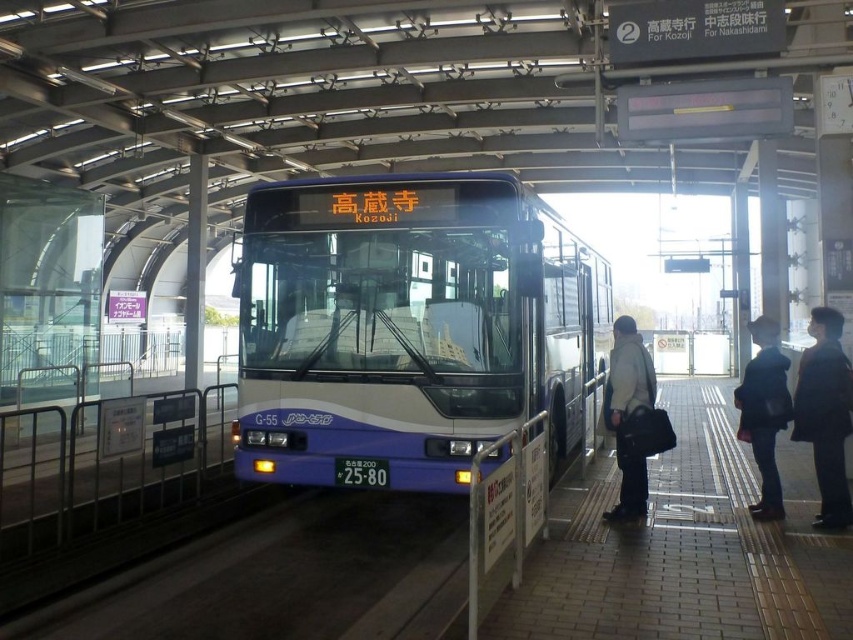
Based on the photo, does blue/white plastic bus at center have a greater height compared to dark blue jacket at right?

Correct, blue/white plastic bus at center is much taller as dark blue jacket at right.

How much distance is there between blue/white plastic bus at center and dark blue jacket at right?

3.01 meters

Describe the element at coordinates (408, 326) in the screenshot. I see `blue/white plastic bus at center` at that location.

Image resolution: width=853 pixels, height=640 pixels. What are the coordinates of `blue/white plastic bus at center` in the screenshot? It's located at (408, 326).

Between point (822, 328) and point (640, 493), which one is positioned in front?

Point (822, 328) is in front.

Who is positioned more to the right, black fabric coat at right or light beige jacket at center?

black fabric coat at right

Which is behind, point (817, 400) or point (641, 376)?

The point (641, 376) is behind.

At what (x,y) coordinates should I click in order to perform the action: click on black fabric coat at right. Please return your answer as a coordinate pair (x, y). The height and width of the screenshot is (640, 853). Looking at the image, I should click on (825, 413).

Who is higher up, dark blue jacket at right or light beige jacket at center?

Positioned higher is dark blue jacket at right.

Who is positioned more to the right, dark blue jacket at right or light beige jacket at center?

Positioned to the right is dark blue jacket at right.

This screenshot has width=853, height=640. Find the location of `dark blue jacket at right`. dark blue jacket at right is located at coordinates (764, 412).